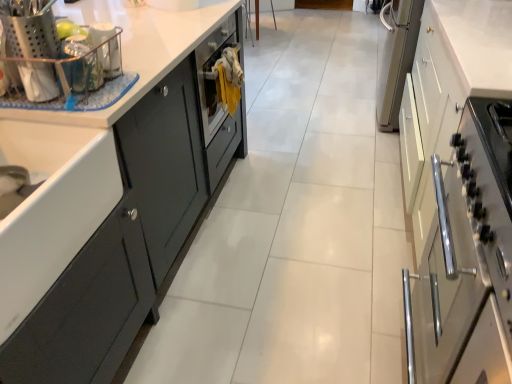
Question: Is satin white cabinet at right, the first cabinetry in the right-to-left sequence, at the back of white glossy countertop at center?

Choices:
 (A) yes
 (B) no

Answer: (B)

Question: From the image's perspective, is white glossy countertop at center above satin white cabinet at right, which is the second cabinetry in left-to-right order?

Choices:
 (A) no
 (B) yes

Answer: (B)

Question: Is the position of white glossy countertop at center more distant than that of satin white cabinet at right, which is the second cabinetry in left-to-right order?

Choices:
 (A) yes
 (B) no

Answer: (A)

Question: From the image's perspective, does white glossy countertop at center appear lower than satin white cabinet at right, which is the second cabinetry in left-to-right order?

Choices:
 (A) no
 (B) yes

Answer: (A)

Question: Is white glossy countertop at center thinner than satin white cabinet at right, the first cabinetry in the right-to-left sequence?

Choices:
 (A) yes
 (B) no

Answer: (A)

Question: Considering their positions, is matte dark gray cabinet at left, the 2th cabinetry positioned from the right, located in front of or behind metallic silver utensil holder at upper left, which is the second appliance in back-to-front order?

Choices:
 (A) behind
 (B) front

Answer: (A)

Question: Considering the relative positions of matte dark gray cabinet at left, the 2th cabinetry positioned from the right, and metallic silver utensil holder at upper left, which is the second appliance from right to left, in the image provided, is matte dark gray cabinet at left, the 2th cabinetry positioned from the right, to the left or to the right of metallic silver utensil holder at upper left, which is the second appliance from right to left,?

Choices:
 (A) left
 (B) right

Answer: (B)

Question: From a real-world perspective, is matte dark gray cabinet at left, which ranks as the 1th cabinetry in left-to-right order, physically located above or below metallic silver utensil holder at upper left, which is counted as the 1th appliance, starting from the left?

Choices:
 (A) above
 (B) below

Answer: (B)

Question: In terms of height, does matte dark gray cabinet at left, which ranks as the 1th cabinetry in left-to-right order, look taller or shorter compared to metallic silver utensil holder at upper left, which is the second appliance from right to left?

Choices:
 (A) tall
 (B) short

Answer: (B)

Question: From the image's perspective, is metallic silver utensil holder at upper left, which is the second appliance in back-to-front order, above or below satin white cabinet at right, which is the second cabinetry in left-to-right order?

Choices:
 (A) below
 (B) above

Answer: (B)

Question: Is point (45, 36) positioned closer to the camera than point (481, 185)?

Choices:
 (A) farther
 (B) closer

Answer: (A)

Question: Based on their positions, is metallic silver utensil holder at upper left, which is the second appliance in back-to-front order, located to the left or right of satin white cabinet at right, the first cabinetry in the right-to-left sequence?

Choices:
 (A) right
 (B) left

Answer: (B)

Question: Considering the positions of metallic silver utensil holder at upper left, which is the second appliance from right to left, and satin white cabinet at right, which is the second cabinetry in left-to-right order, in the image, is metallic silver utensil holder at upper left, which is the second appliance from right to left, bigger or smaller than satin white cabinet at right, which is the second cabinetry in left-to-right order,?

Choices:
 (A) small
 (B) big

Answer: (A)

Question: Considering the positions of satin white cabinet at right, the first cabinetry in the right-to-left sequence, and metallic wire basket at upper left, the second appliance positioned from the left, in the image, is satin white cabinet at right, the first cabinetry in the right-to-left sequence, wider or thinner than metallic wire basket at upper left, the second appliance positioned from the left,?

Choices:
 (A) thin
 (B) wide

Answer: (B)

Question: In the image, is satin white cabinet at right, which is the second cabinetry in left-to-right order, positioned in front of or behind metallic wire basket at upper left, acting as the second appliance starting from the front?

Choices:
 (A) front
 (B) behind

Answer: (A)